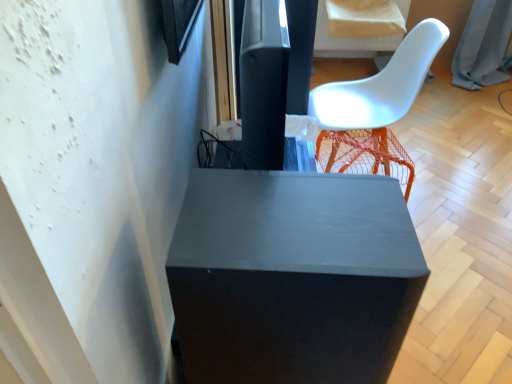
What is the approximate width of matte black speaker at upper center?

14.24 inches.

This screenshot has height=384, width=512. In order to click on matte black speaker at upper center in this screenshot , I will do `click(264, 83)`.

Identify the location of orange mesh stool at right. The image size is (512, 384). (365, 154).

This screenshot has height=384, width=512. Describe the element at coordinates (375, 107) in the screenshot. I see `white plastic chair at upper right` at that location.

Measure the distance between point (219,319) and camera.

Point (219,319) is 23.07 inches from camera.

Image resolution: width=512 pixels, height=384 pixels. Describe the element at coordinates (293, 277) in the screenshot. I see `matte black cube at center` at that location.

The image size is (512, 384). I want to click on matte black speaker at upper center, so 264,83.

Is white plastic chair at upper right to the right of matte black speaker at upper center from the viewer's perspective?

Yes.

From the picture: Does white plastic chair at upper right come in front of matte black speaker at upper center?

Yes, it is.

Between white plastic chair at upper right and matte black speaker at upper center, which one has more height?

With more height is white plastic chair at upper right.

Is matte black speaker at upper center at the back of white plastic chair at upper right?

No, white plastic chair at upper right is not facing away from matte black speaker at upper center.

How different are the orientations of orange mesh stool at right and white plastic chair at upper right in degrees?

orange mesh stool at right and white plastic chair at upper right are facing 173 degrees away from each other.

You are a GUI agent. You are given a task and a screenshot of the screen. Output one action in this format:
    pyautogui.click(x=<x>, y=<y>)
    Task: Click on the bar stool on the left of the white plastic chair at upper right
    The width and height of the screenshot is (512, 384).
    Given the screenshot: What is the action you would take?
    pyautogui.click(x=365, y=154)

Considering their positions, is orange mesh stool at right located in front of or behind white plastic chair at upper right?

orange mesh stool at right is positioned farther from the viewer than white plastic chair at upper right.

Does orange mesh stool at right have a greater width compared to white plastic chair at upper right?

In fact, orange mesh stool at right might be narrower than white plastic chair at upper right.

Which object is further away from the camera taking this photo, matte black cube at center or orange mesh stool at right?

orange mesh stool at right is further away from the camera.

Which is correct: matte black cube at center is inside orange mesh stool at right, or outside of it?

matte black cube at center lies outside orange mesh stool at right.

Is matte black cube at center far away from orange mesh stool at right?

Absolutely, matte black cube at center is distant from orange mesh stool at right.

Is matte black cube at center aimed at orange mesh stool at right?

No, matte black cube at center is not oriented towards orange mesh stool at right.

Does orange mesh stool at right have a lesser width compared to matte black speaker at upper center?

In fact, orange mesh stool at right might be wider than matte black speaker at upper center.

From a real-world perspective, is orange mesh stool at right over matte black speaker at upper center?

No, from a real-world perspective, orange mesh stool at right is not over matte black speaker at upper center

How different are the orientations of orange mesh stool at right and matte black speaker at upper center in degrees?

There is a 8.35-degree angle between the facing directions of orange mesh stool at right and matte black speaker at upper center.

Measure the distance from orange mesh stool at right to matte black speaker at upper center.

37.19 inches.

Is white plastic chair at upper right facing away from orange mesh stool at right?

white plastic chair at upper right does not have its back to orange mesh stool at right.

Does white plastic chair at upper right have a larger size compared to orange mesh stool at right?

Correct, white plastic chair at upper right is larger in size than orange mesh stool at right.

How different are the orientations of white plastic chair at upper right and orange mesh stool at right in degrees?

The angular difference between white plastic chair at upper right and orange mesh stool at right is 173 degrees.

Measure the distance from white plastic chair at upper right to orange mesh stool at right.

A distance of 6.35 inches exists between white plastic chair at upper right and orange mesh stool at right.

Considering the relative positions of matte black cube at center and matte black speaker at upper center in the image provided, is matte black cube at center to the right of matte black speaker at upper center from the viewer's perspective?

Incorrect, matte black cube at center is not on the right side of matte black speaker at upper center.

Considering the positions of objects matte black cube at center and matte black speaker at upper center in the image provided, who is behind, matte black cube at center or matte black speaker at upper center?

matte black speaker at upper center is behind.

Can you see matte black cube at center touching matte black speaker at upper center?

They are not placed beside each other.

Is the depth of matte black speaker at upper center greater than that of orange mesh stool at right?

Yes, it is.

Considering the relative sizes of matte black speaker at upper center and orange mesh stool at right in the image provided, is matte black speaker at upper center shorter than orange mesh stool at right?

No.

Where is `pillar that is on the left side of white plastic chair at upper right`? Image resolution: width=512 pixels, height=384 pixels. pillar that is on the left side of white plastic chair at upper right is located at coordinates (264, 83).

Find the location of `bar stool located behind the white plastic chair at upper right`. bar stool located behind the white plastic chair at upper right is located at coordinates (365, 154).

Looking at the image, which one is located closer to matte black speaker at upper center, orange mesh stool at right or white plastic chair at upper right?

orange mesh stool at right.

Estimate the real-world distances between objects in this image. Which object is closer to matte black cube at center, matte black speaker at upper center or orange mesh stool at right?

matte black speaker at upper center.

When comparing their distances from orange mesh stool at right, does matte black speaker at upper center or white plastic chair at upper right seem closer?

white plastic chair at upper right lies closer to orange mesh stool at right than the other object.

Looking at the image, which one is located closer to matte black speaker at upper center, matte black cube at center or white plastic chair at upper right?

matte black cube at center is closer to matte black speaker at upper center.

When comparing their distances from orange mesh stool at right, does white plastic chair at upper right or matte black cube at center seem closer?

The object closer to orange mesh stool at right is white plastic chair at upper right.

From the image, which object appears to be farther from matte black cube at center, white plastic chair at upper right or matte black speaker at upper center?

white plastic chair at upper right is positioned further to the anchor matte black cube at center.

From the image, which object appears to be nearer to white plastic chair at upper right, orange mesh stool at right or matte black cube at center?

The object closer to white plastic chair at upper right is orange mesh stool at right.

Looking at the image, which one is located further to matte black cube at center, orange mesh stool at right or white plastic chair at upper right?

white plastic chair at upper right lies further to matte black cube at center than the other object.

Identify the location of chair between matte black speaker at upper center and orange mesh stool at right in the up-down direction. This screenshot has width=512, height=384. pos(375,107).

Image resolution: width=512 pixels, height=384 pixels. What are the coordinates of `chair between matte black cube at center and matte black speaker at upper center from front to back` in the screenshot? It's located at (375, 107).

You are a GUI agent. You are given a task and a screenshot of the screen. Output one action in this format:
    pyautogui.click(x=<x>, y=<y>)
    Task: Click on the bar stool between matte black cube at center and matte black speaker at upper center from front to back
    The image size is (512, 384).
    Given the screenshot: What is the action you would take?
    [365, 154]

Identify the location of chair positioned between matte black cube at center and orange mesh stool at right from near to far. (375, 107).